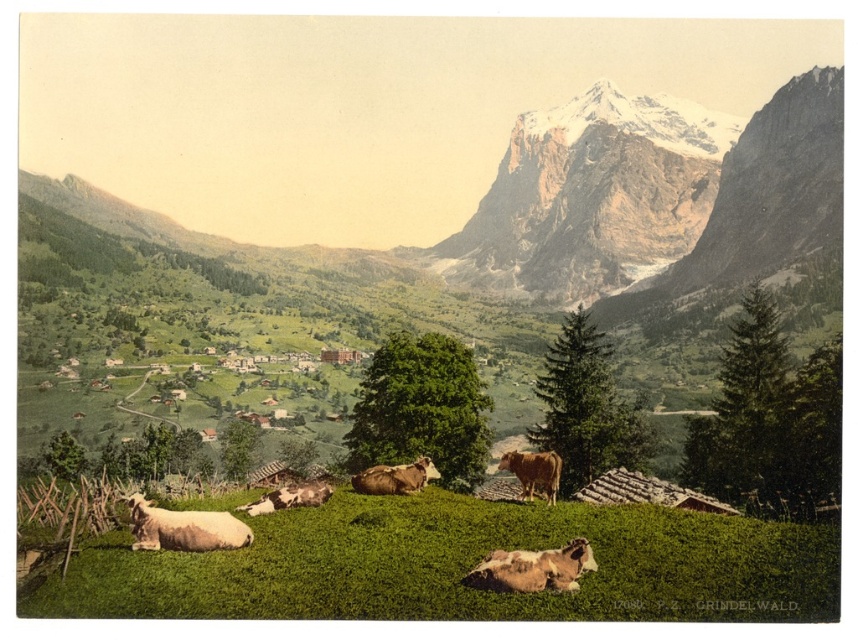
From the picture: Which of these two, snowy granite peak at upper center or brown furry cow at center, stands shorter?

brown furry cow at center

Does snowy granite peak at upper center have a smaller size compared to brown furry cow at center?

Actually, snowy granite peak at upper center might be larger than brown furry cow at center.

Is point (491, 227) closer to camera compared to point (431, 477)?

No, it is not.

This screenshot has height=640, width=858. What are the coordinates of `snowy granite peak at upper center` in the screenshot? It's located at (591, 196).

Which is in front, point (662, 220) or point (573, 566)?

Point (573, 566) is more forward.

Image resolution: width=858 pixels, height=640 pixels. I want to click on rugged stone mountain at center, so click(478, 259).

Between brown speckled cow at lower center and white woolly sheep at lower left, which one has more height?

brown speckled cow at lower center is taller.

Is point (530, 586) farther from camera compared to point (162, 520)?

No, it is not.

Measure the distance between point (588, 570) and camera.

The distance of point (588, 570) from camera is 98.33 meters.

The height and width of the screenshot is (640, 858). In order to click on brown speckled cow at lower center in this screenshot , I will do `click(532, 568)`.